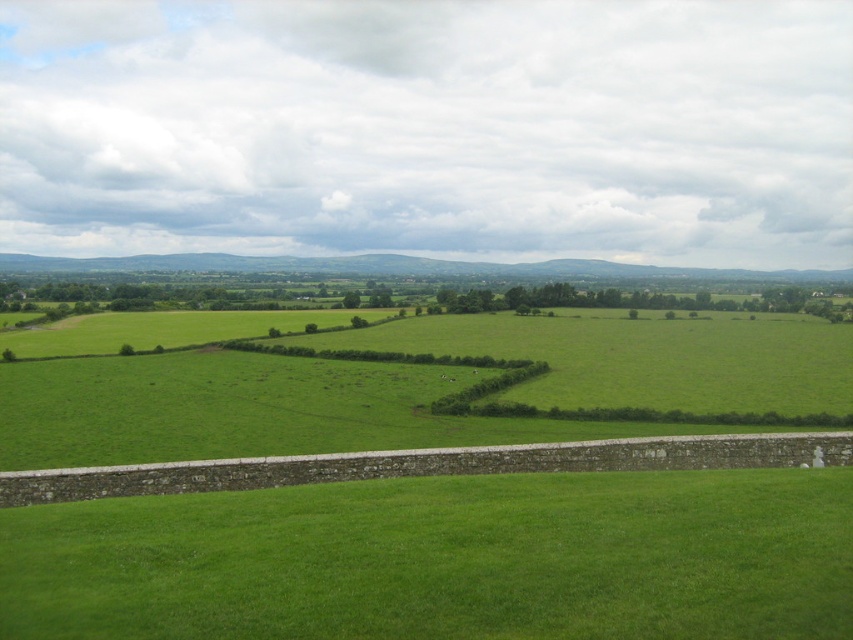
Question: Is green grass field at center above green grassy hedge at center?

Choices:
 (A) no
 (B) yes

Answer: (B)

Question: Is green grass at bottom to the left of green grassy hedge at center from the viewer's perspective?

Choices:
 (A) no
 (B) yes

Answer: (B)

Question: Among these points, which one is farthest from the camera?

Choices:
 (A) (343, 541)
 (B) (461, 408)
 (C) (61, 380)

Answer: (C)

Question: Among these objects, which one is nearest to the camera?

Choices:
 (A) green grass field at center
 (B) green grass at bottom

Answer: (B)

Question: Which of these objects is positioned farthest from the green grassy hedge at center?

Choices:
 (A) green grass at bottom
 (B) green grass field at center

Answer: (B)

Question: In this image, where is green grass at bottom located relative to green grassy hedge at center?

Choices:
 (A) right
 (B) left

Answer: (B)